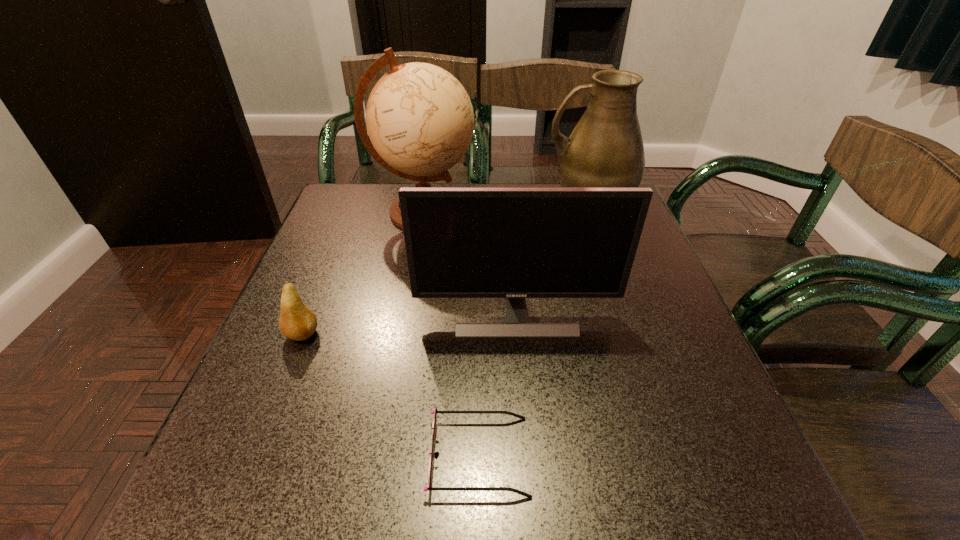
At what (x,y) coordinates should I click in order to perform the action: click on free area in between the globe and the sunglasses. Please return your answer as a coordinate pair (x, y). Image resolution: width=960 pixels, height=540 pixels. Looking at the image, I should click on (451, 334).

At what (x,y) coordinates should I click in order to perform the action: click on empty space that is in between the globe and the sunglasses. Please return your answer as a coordinate pair (x, y). The height and width of the screenshot is (540, 960). Looking at the image, I should click on (451, 334).

Where is `free space between the nearest object and the leftmost object`? The width and height of the screenshot is (960, 540). free space between the nearest object and the leftmost object is located at coordinates (391, 395).

Locate an element on the screen. The height and width of the screenshot is (540, 960). object that stands as the closest to the tallest object is located at coordinates pos(514,243).

Select which object is the third closest to the fourth tallest object. Please provide its 2D coordinates. Your answer should be formatted as a tuple, i.e. [(x, y)], where the tuple contains the x and y coordinates of a point satisfying the conditions above.

[(420, 120)]

Where is `free location that satisfies the following two spatial constraints: 1. on the screen side of the monitor; 2. on the bridge of the nearest object`? free location that satisfies the following two spatial constraints: 1. on the screen side of the monitor; 2. on the bridge of the nearest object is located at coordinates (528, 456).